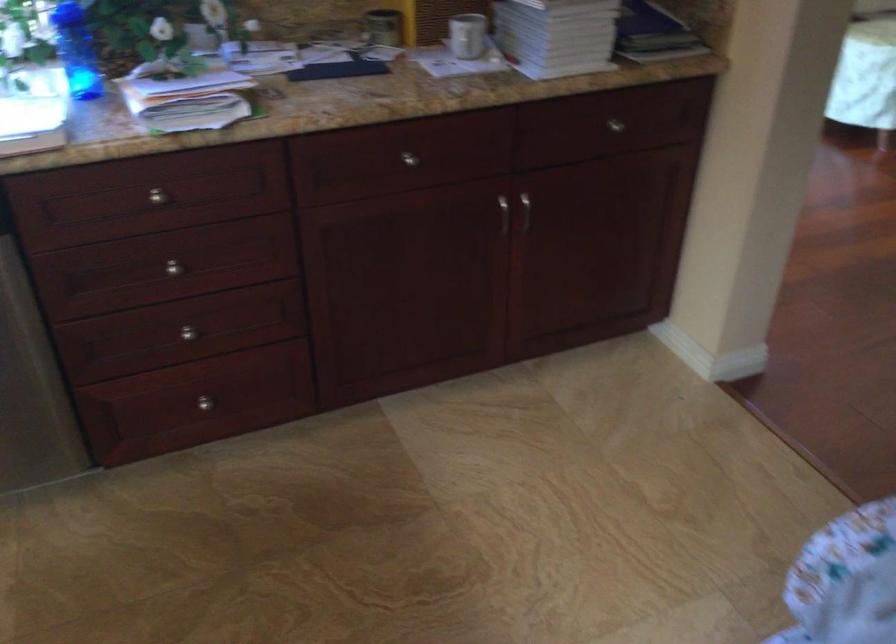
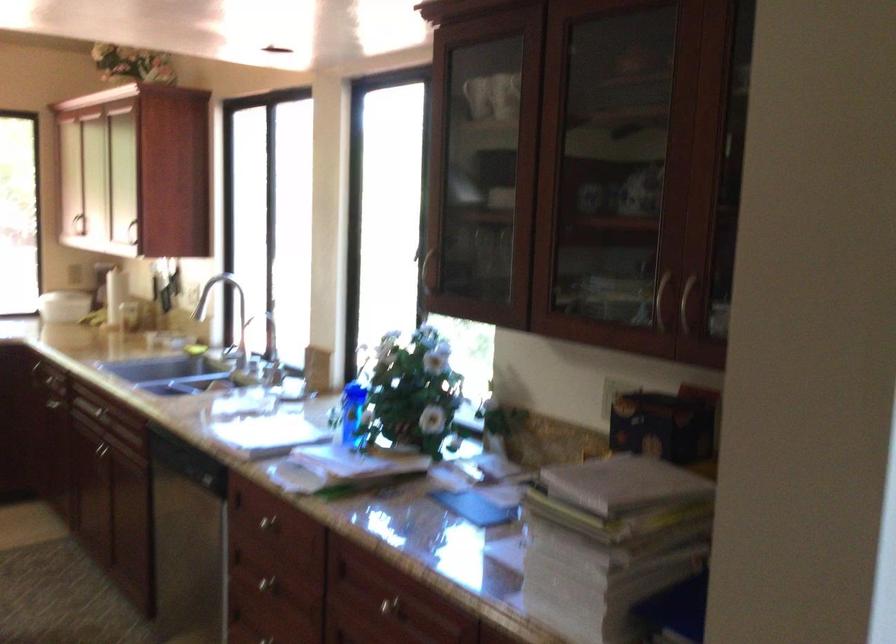
Locate, in the second image, the point that corresponds to (159,196) in the first image.

(268, 522)